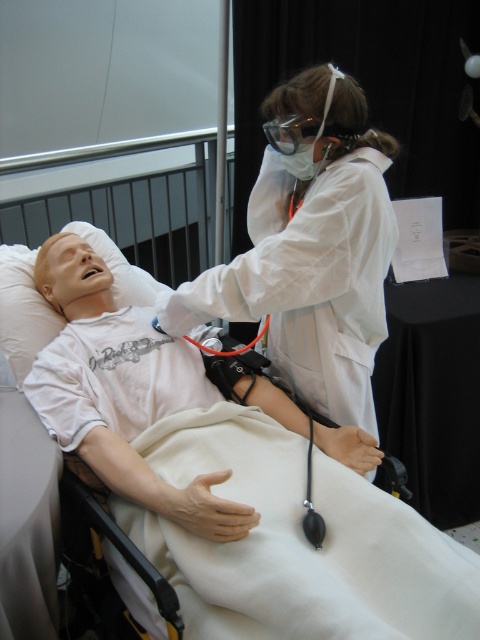
Which of these two, white matte lab coat at upper center or transparent plastic goggles at upper center, stands taller?

white matte lab coat at upper center is taller.

Which is behind, point (321, 384) or point (352, 131)?

The point (321, 384) is more distant.

Locate an element on the screen. The width and height of the screenshot is (480, 640). white matte lab coat at upper center is located at coordinates (312, 252).

Is white matte lab coat at upper center bigger than white matte mannequin at center?

No.

Is point (346, 259) less distant than point (194, 374)?

Yes.

Does point (348, 125) come closer to viewer compared to point (78, 420)?

Yes, point (348, 125) is in front of point (78, 420).

Image resolution: width=480 pixels, height=640 pixels. I want to click on white matte lab coat at upper center, so click(x=312, y=252).

Is point (263, 404) less distant than point (305, 131)?

No, (263, 404) is further to viewer.

Can you confirm if white matte mannequin at center is wider than transparent plastic goggles at upper center?

Correct, the width of white matte mannequin at center exceeds that of transparent plastic goggles at upper center.

This screenshot has height=640, width=480. What are the coordinates of `white matte mannequin at center` in the screenshot? It's located at (120, 388).

Where is `white matte mannequin at center`? white matte mannequin at center is located at coordinates (120, 388).